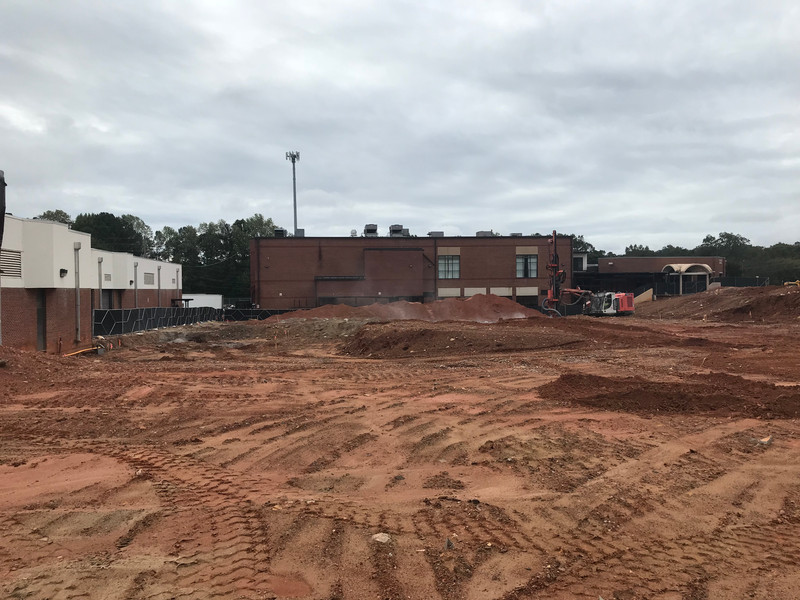
Where is `white curtains`? white curtains is located at coordinates (530, 266), (518, 271), (453, 271), (441, 271).